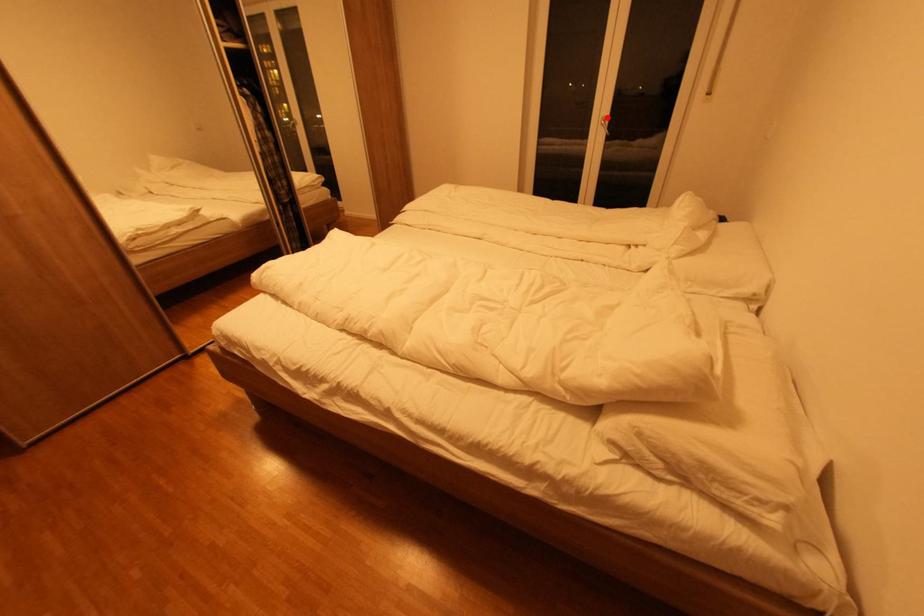
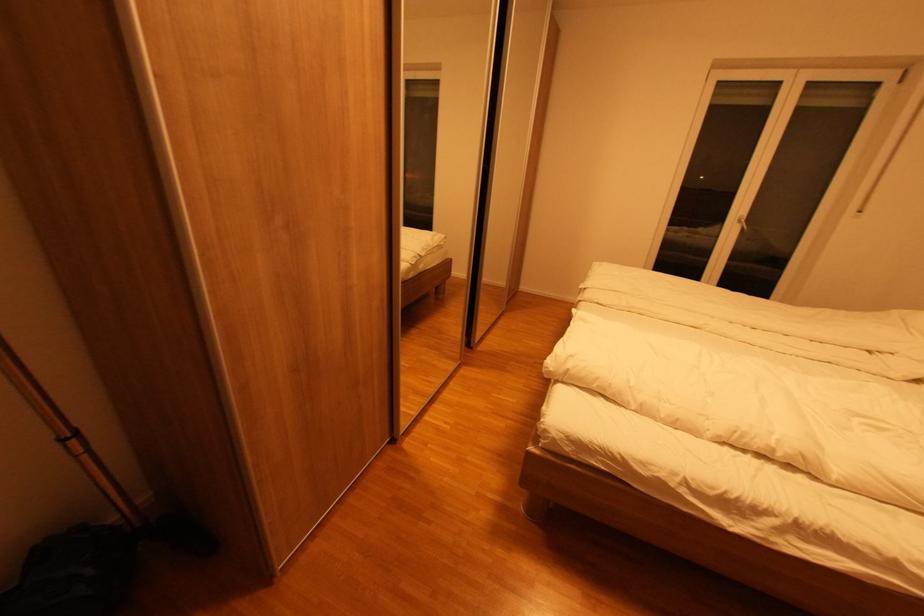
Question: I am providing you with two images of the same scene from different viewpoints. A red point is marked on the first image. Is the red point's position out of view in image 2?

Choices:
 (A) Yes
 (B) No

Answer: (B)